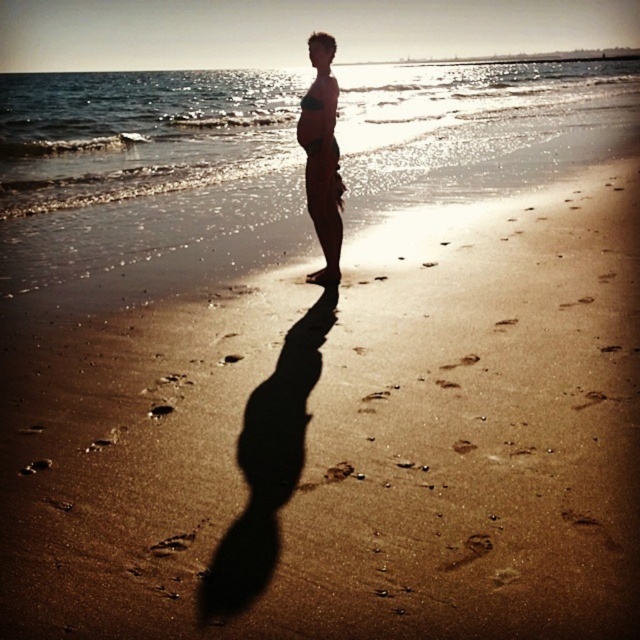
You are a photographer trying to capture the silhouette of the person in the scene. You need to ensure that the translucent water at upper center does not cover the matte skin at center in your shot. Based on their heights, which object should you focus on to avoid overlap?

The translucent water at upper center is taller than the matte skin at center. To avoid overlap, focus on the matte skin at center since it is shorter and positioned lower in the frame.

You are standing on the beach and want to reach a seashell located at point (26, 124). If your walking speed is 3 feet per second, how many seconds will it take you to reach the seashell?

The point (26, 124) is 78.10 feet away from the viewer. At a walking speed of 3 feet per second, it will take 78.10 divided by 3, which is approximately 26.03 seconds to reach the seashell.

You are a photographer positioned at the shoreline in the beach scene. You want to capture a photo that includes both the point at coordinates point [554,108] and point [310,42]. Which of these points will appear closer to the bottom edge of your camera frame?

Point [554,108] is further to the camera than point [310,42], so the point at coordinates point [554,108] will appear closer to the bottom edge of your camera frame.